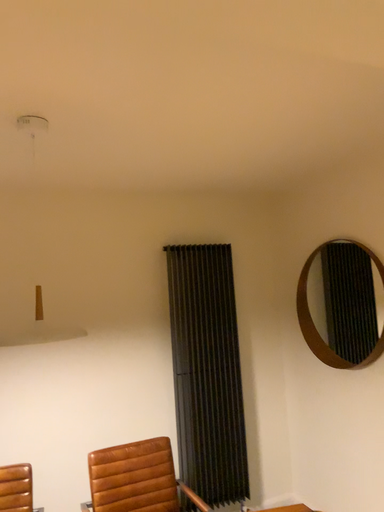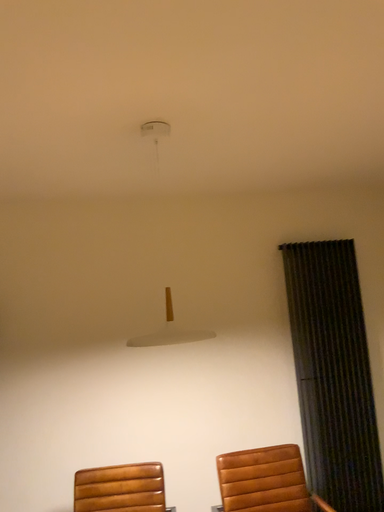
Question: How did the camera likely rotate when shooting the video?

Choices:
 (A) rotated right
 (B) rotated left

Answer: (B)